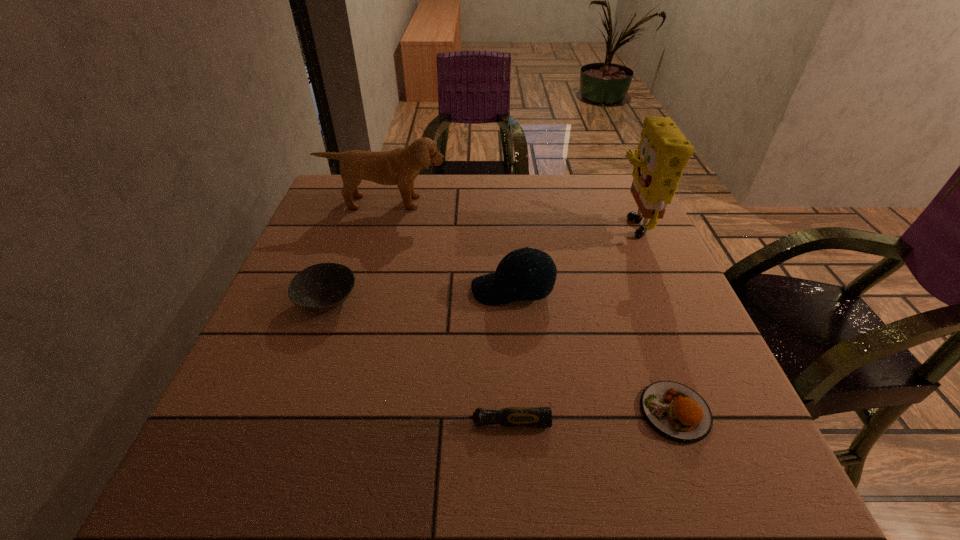
Find the location of a particular element. free space located on the front-facing side of the baseball cap is located at coordinates (435, 290).

Find the location of a particular element. This screenshot has height=540, width=960. vacant position located 0.140m on the front-facing side of the baseball cap is located at coordinates (407, 290).

You are a GUI agent. You are given a task and a screenshot of the screen. Output one action in this format:
    pyautogui.click(x=<x>, y=<y>)
    Task: Click on the free space located on the front-facing side of the baseball cap
    
    Given the screenshot: What is the action you would take?
    pyautogui.click(x=306, y=290)

Where is `vacant space positioned on the right of the third shortest object`? This screenshot has height=540, width=960. vacant space positioned on the right of the third shortest object is located at coordinates (415, 301).

Find the location of a particular element. vacant space located on the back of the patty is located at coordinates (618, 258).

You are a GUI agent. You are given a task and a screenshot of the screen. Output one action in this format:
    pyautogui.click(x=<x>, y=<y>)
    Task: Click on the vacant position located 0.200m insert the shortest object into a screw head
    
    Given the screenshot: What is the action you would take?
    pyautogui.click(x=291, y=423)

Image resolution: width=960 pixels, height=540 pixels. I want to click on free spot located insert the shortest object into a screw head, so click(218, 423).

The image size is (960, 540). I want to click on vacant space situated insert the shortest object into a screw head, so click(303, 423).

Identify the location of sponge present at the far edge. The width and height of the screenshot is (960, 540). (663, 152).

The height and width of the screenshot is (540, 960). Identify the location of puppy that is at the far edge. (400, 166).